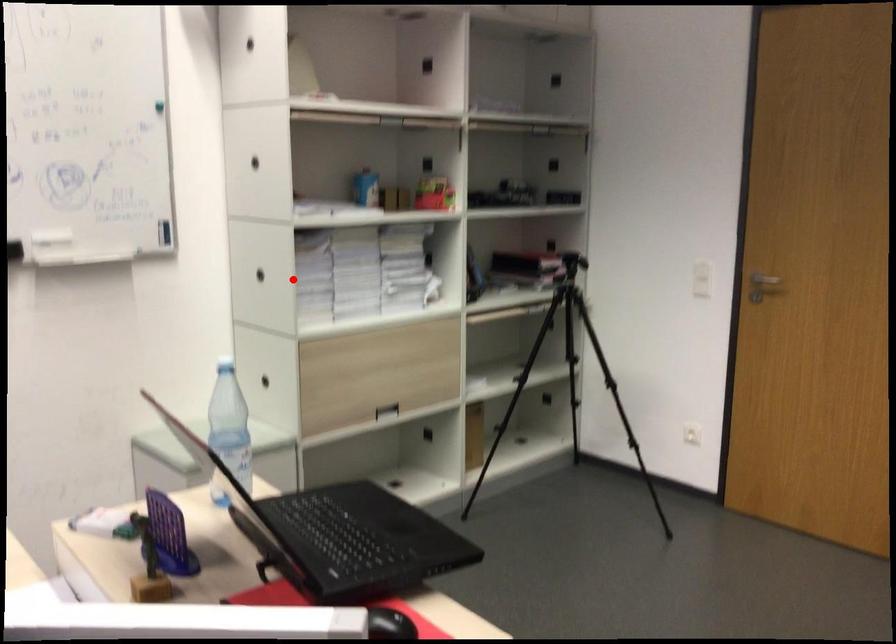
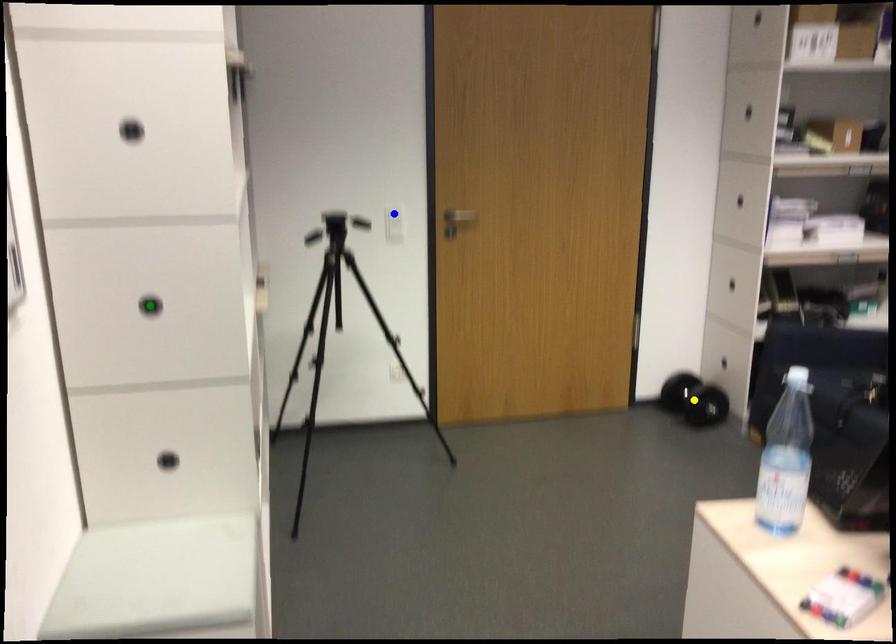
Question: I am providing you with two images of the same scene from different viewpoints. A red point is marked on the first image. You are given multiple points on the second image. In image 2, which mark is for the same physical point as the one in image 1?

Choices:
 (A) yellow point
 (B) green point
 (C) blue point

Answer: (B)